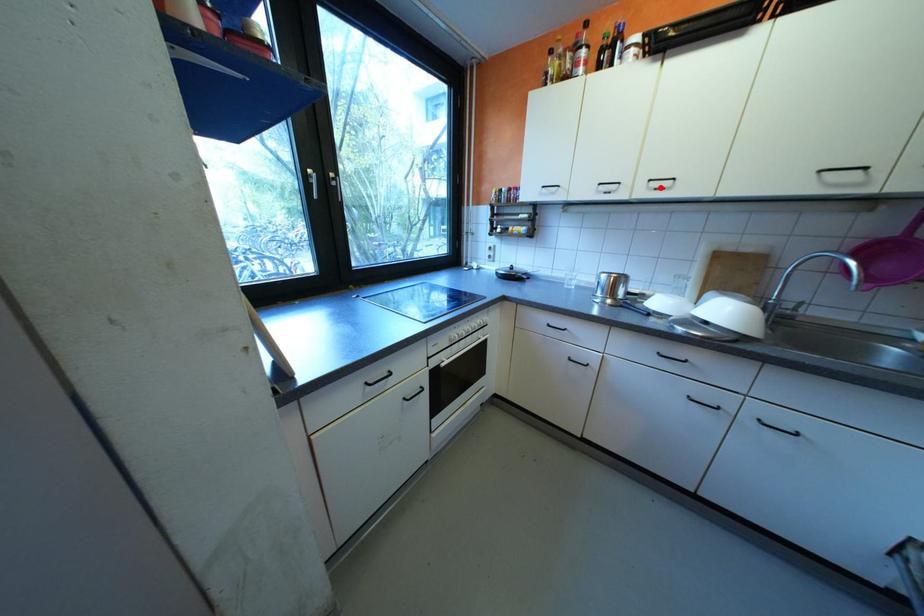
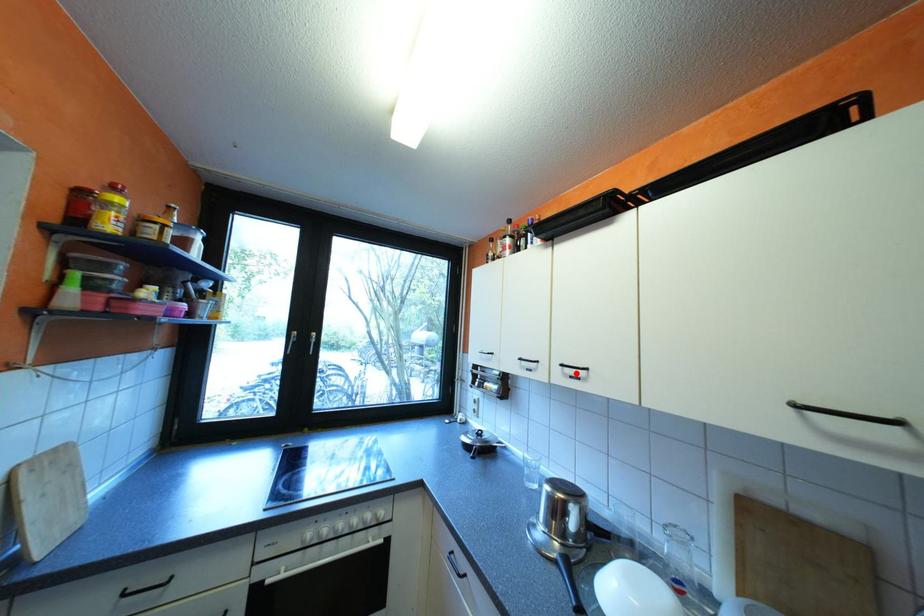
I am providing you with two images of the same scene from different viewpoints. A red point is marked on the first image and another point is marked on the second image. Does the point marked in image1 correspond to the same location as the one in image2?

Yes